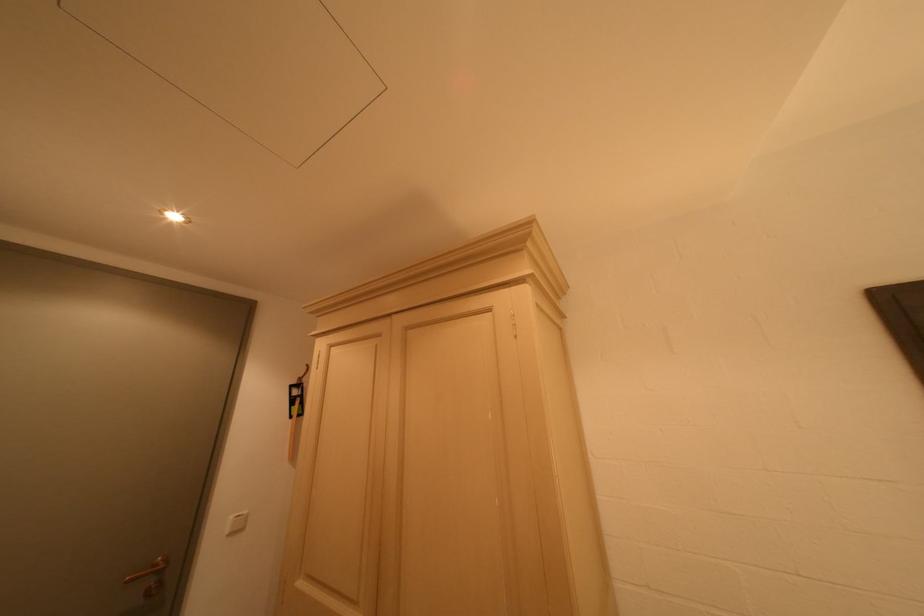
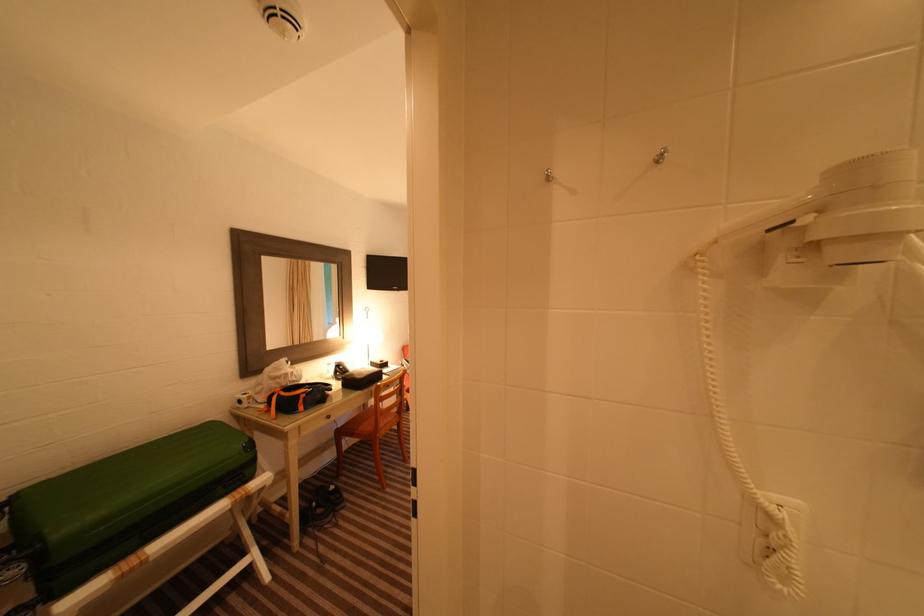
Question: Based on the continuous images, in which direction is the camera rotating? Reply with the corresponding letter.

Choices:
 (A) Left
 (B) Right
 (C) Up
 (D) Down

Answer: (B)